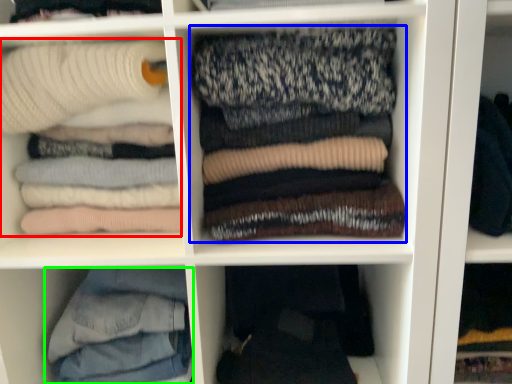
Question: Which object is positioned closest to laundry (highlighted by a red box)? Select from laundry (highlighted by a blue box) and trousers (highlighted by a green box).

Choices:
 (A) laundry
 (B) trousers

Answer: (A)